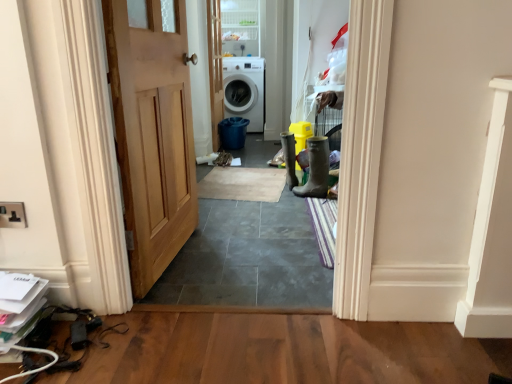
Question: In the image, is natural wood door at center, acting as the first door starting from the front, on the left side or the right side of clear glass door at upper center?

Choices:
 (A) left
 (B) right

Answer: (A)

Question: Looking at their shapes, would you say natural wood door at center, acting as the first door starting from the front, is wider or thinner than clear glass door at upper center?

Choices:
 (A) thin
 (B) wide

Answer: (A)

Question: Which object is positioned closest to the white glossy washing machine at center?

Choices:
 (A) natural wood door at center, acting as the first door starting from the front
 (B) white glossy door at center, placed as the 1th door when sorted from back to front
 (C) clear glass door at upper center

Answer: (C)

Question: Estimate the real-world distances between objects in this image. Which object is closer to the clear glass door at upper center?

Choices:
 (A) white glossy door at center, the second door positioned from the front
 (B) white glossy washing machine at center
 (C) natural wood door at center, positioned as the second door in back-to-front order

Answer: (B)